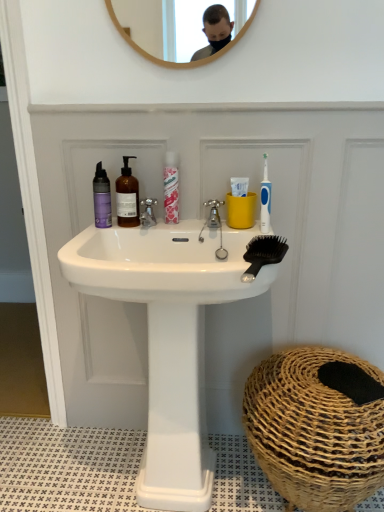
Where is `vacant area located to the right-hand side of pink glossy mouthwash at center, which ranks as the 3th mouthwash in left-to-right order`? Image resolution: width=384 pixels, height=512 pixels. vacant area located to the right-hand side of pink glossy mouthwash at center, which ranks as the 3th mouthwash in left-to-right order is located at coordinates click(201, 221).